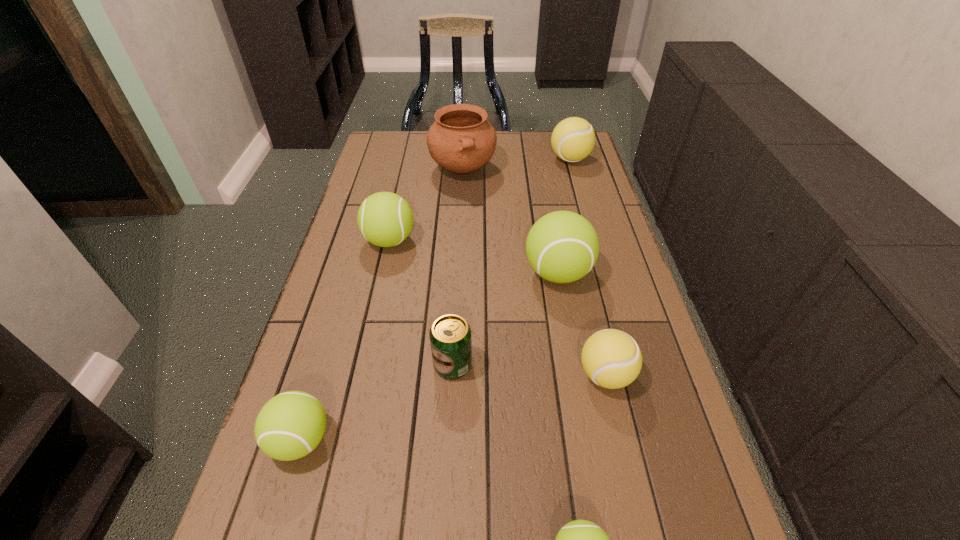
This screenshot has height=540, width=960. In the image, there is a desktop. What are the coordinates of `vacant space at the far edge` in the screenshot? It's located at (501, 153).

The width and height of the screenshot is (960, 540). I want to click on vacant space at the left edge of the desktop, so click(x=310, y=347).

What are the coordinates of `free region at the right edge` in the screenshot? It's located at (583, 170).

At what (x,y) coordinates should I click in order to perform the action: click on vacant region between the second nearest green tennis ball and the beer can. Please return your answer as a coordinate pair (x, y). Image resolution: width=960 pixels, height=540 pixels. Looking at the image, I should click on (376, 402).

This screenshot has height=540, width=960. Find the location of `vacant space in between the third biggest green tennis ball and the third smallest green tennis ball`. vacant space in between the third biggest green tennis ball and the third smallest green tennis ball is located at coordinates (345, 340).

Where is `vacant area between the second nearest object and the beer can`? The height and width of the screenshot is (540, 960). vacant area between the second nearest object and the beer can is located at coordinates (376, 402).

The width and height of the screenshot is (960, 540). I want to click on vacant space in between the beer can and the third smallest green tennis ball, so click(x=421, y=302).

Where is `the fourth closest object to the green beer can`? This screenshot has width=960, height=540. the fourth closest object to the green beer can is located at coordinates (580, 539).

Find the location of a particular element. This screenshot has width=960, height=540. object that is the fourth closest one to the farther yellow tennis ball is located at coordinates click(x=612, y=359).

Select which tennis ball appears as the third closest to the shortest object. Please provide its 2D coordinates. Your answer should be formatted as a tuple, i.e. [(x, y)], where the tuple contains the x and y coordinates of a point satisfying the conditions above.

[(562, 246)]